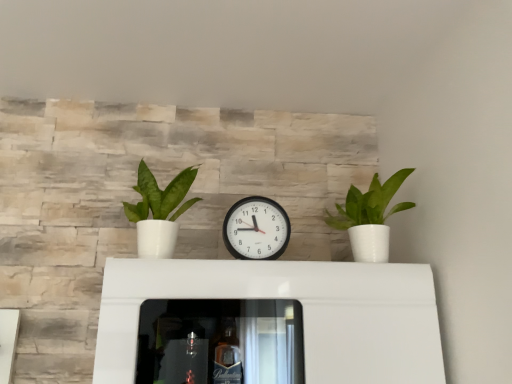
Question: Would you say green matte plant at left, the 2th houseplant from the right, is inside or outside white glossy pot at right, the first houseplant when ordered from right to left?

Choices:
 (A) inside
 (B) outside

Answer: (B)

Question: In the image, is green matte plant at left, arranged as the 1th houseplant when viewed from the left, positioned in front of or behind white glossy pot at right, acting as the second houseplant starting from the left?

Choices:
 (A) front
 (B) behind

Answer: (A)

Question: Which object is positioned farthest from the white glossy pot at right, the first houseplant when ordered from right to left?

Choices:
 (A) black plastic wall clock at center
 (B) green matte plant at left, the 2th houseplant from the right

Answer: (B)

Question: Which of these objects is positioned closest to the green matte plant at left, arranged as the 1th houseplant when viewed from the left?

Choices:
 (A) black plastic wall clock at center
 (B) white glossy pot at right, acting as the second houseplant starting from the left

Answer: (A)